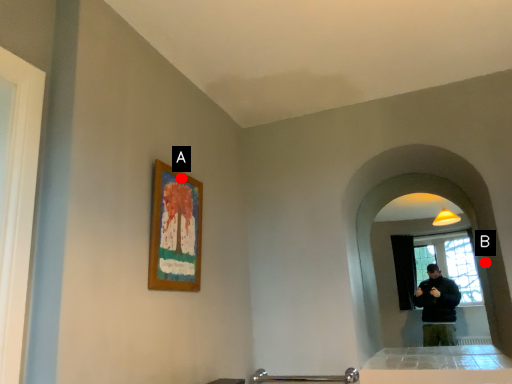
Question: Two points are circled on the image, labeled by A and B beside each circle. Which point is further to the camera?

Choices:
 (A) A is further
 (B) B is further

Answer: (B)